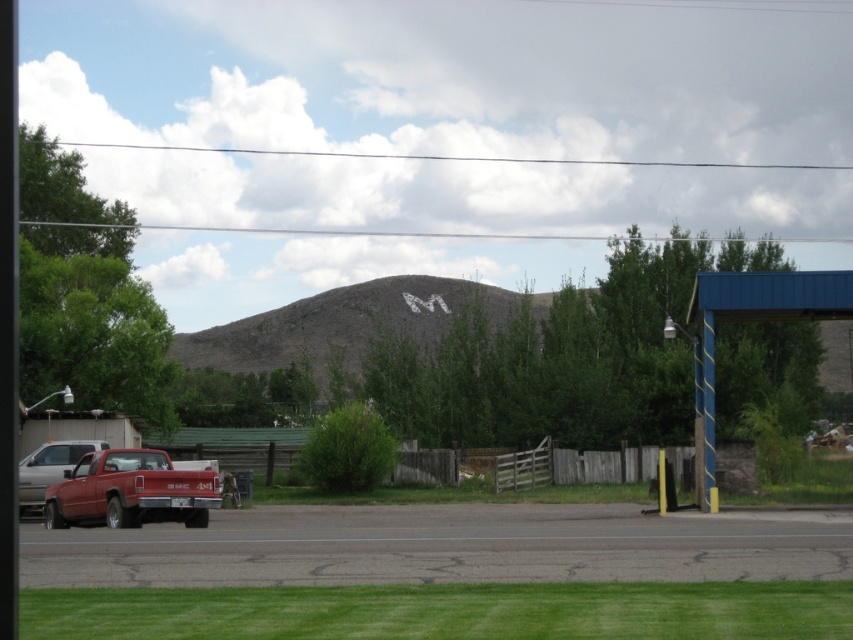
Question: Which is farther from the gray rocky mountain at center?

Choices:
 (A) matte red truck at lower left
 (B) matte red pickup truck at lower left

Answer: (B)

Question: Considering the real-world distances, which object is closest to the matte red truck at lower left?

Choices:
 (A) gray rocky mountain at center
 (B) matte red pickup truck at lower left

Answer: (B)

Question: Is gray rocky mountain at center smaller than matte red truck at lower left?

Choices:
 (A) no
 (B) yes

Answer: (A)

Question: Which object is farther from the camera taking this photo?

Choices:
 (A) matte red truck at lower left
 (B) matte red pickup truck at lower left

Answer: (A)

Question: Does gray rocky mountain at center appear on the right side of matte red pickup truck at lower left?

Choices:
 (A) no
 (B) yes

Answer: (A)

Question: Can you confirm if gray rocky mountain at center is bigger than matte red pickup truck at lower left?

Choices:
 (A) no
 (B) yes

Answer: (B)